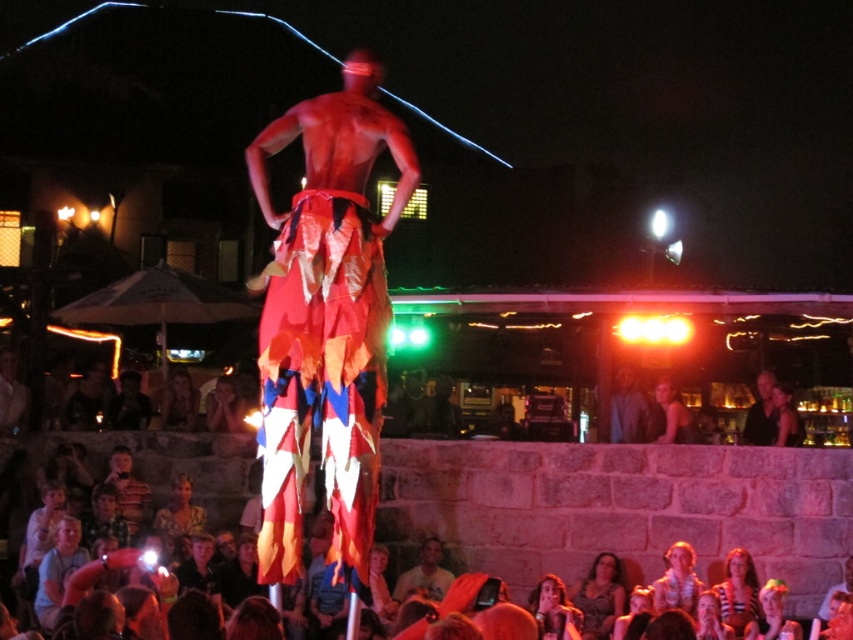
You are a photographer at the event and want to capture both smooth skin face at center and smooth skin face at lower center in a single shot. Which face is positioned to the right side when framing the photo?

The smooth skin face at center is positioned to the right of the smooth skin face at lower center.

You are a spectator at the nighttime performance. You notice two items in the scene, the red fabric pants at center and the patterned fabric dress at lower center. Which of these items is positioned higher in the image?

The red fabric pants at center is located above the patterned fabric dress at lower center, so it is positioned higher in the image.